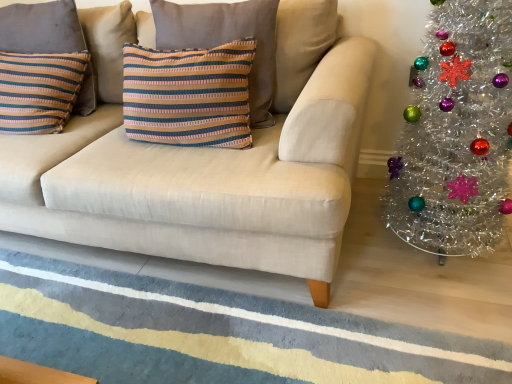
I want to click on vacant space in between beige fabric couch at center and tinsel silver christmas tree at right, so click(x=391, y=276).